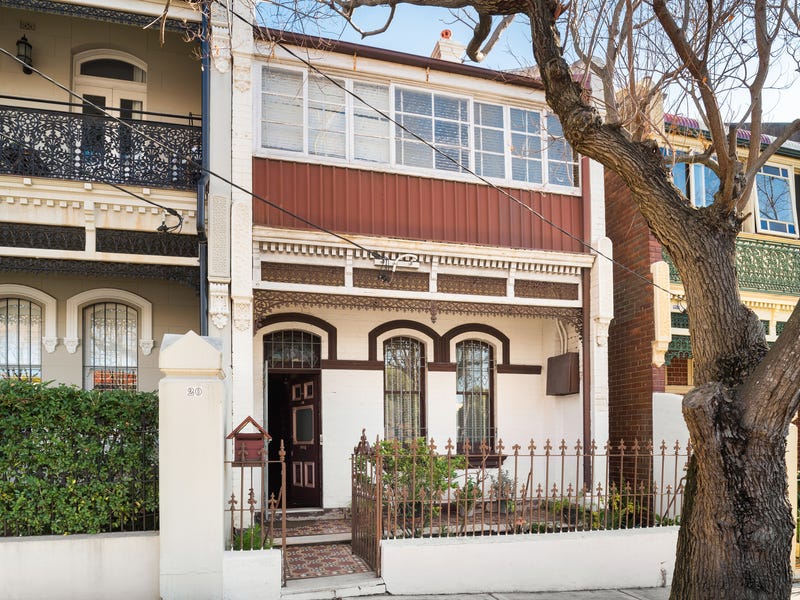
Identify the location of bar. This screenshot has height=600, width=800. (746, 456), (740, 477).